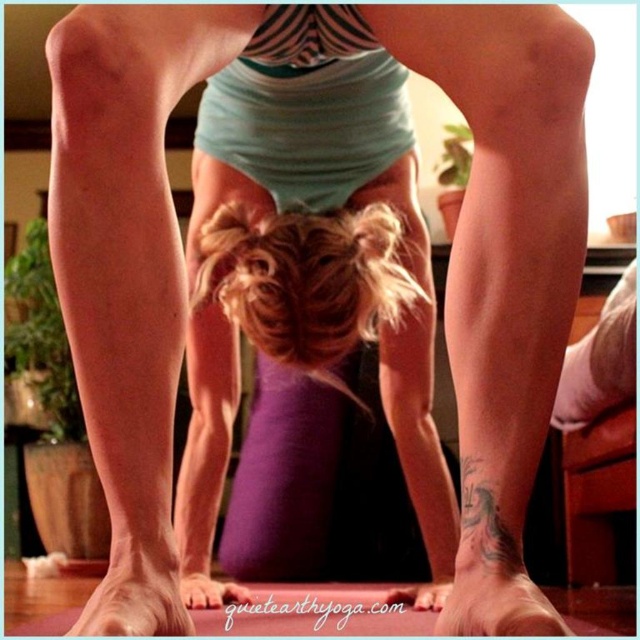
Question: Which is farther from the smooth skin leg at lower left?

Choices:
 (A) smooth skin leg at lower center
 (B) blonde hair at center

Answer: (B)

Question: Is smooth skin leg at lower center to the left of smooth skin leg at lower left from the viewer's perspective?

Choices:
 (A) yes
 (B) no

Answer: (B)

Question: Does smooth skin leg at lower left come behind smooth skin foot at lower center?

Choices:
 (A) no
 (B) yes

Answer: (B)

Question: Does blonde hair at center have a smaller size compared to smooth skin leg at lower left?

Choices:
 (A) yes
 (B) no

Answer: (B)

Question: Which of the following is the farthest from the observer?

Choices:
 (A) blonde hair at center
 (B) smooth skin foot at lower center
 (C) smooth skin leg at lower left
 (D) smooth skin leg at lower center

Answer: (A)

Question: Estimate the real-world distances between objects in this image. Which object is farther from the smooth skin leg at lower left?

Choices:
 (A) smooth skin leg at lower center
 (B) pink matte foot at lower left
 (C) smooth skin foot at lower center
 (D) blonde hair at center

Answer: (D)